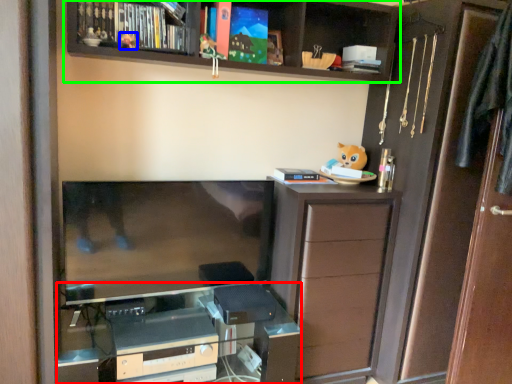
Question: Which object is positioned closest to computer desk (highlighted by a red box)? Select from toy (highlighted by a blue box) and shelf (highlighted by a green box).

Choices:
 (A) toy
 (B) shelf

Answer: (B)